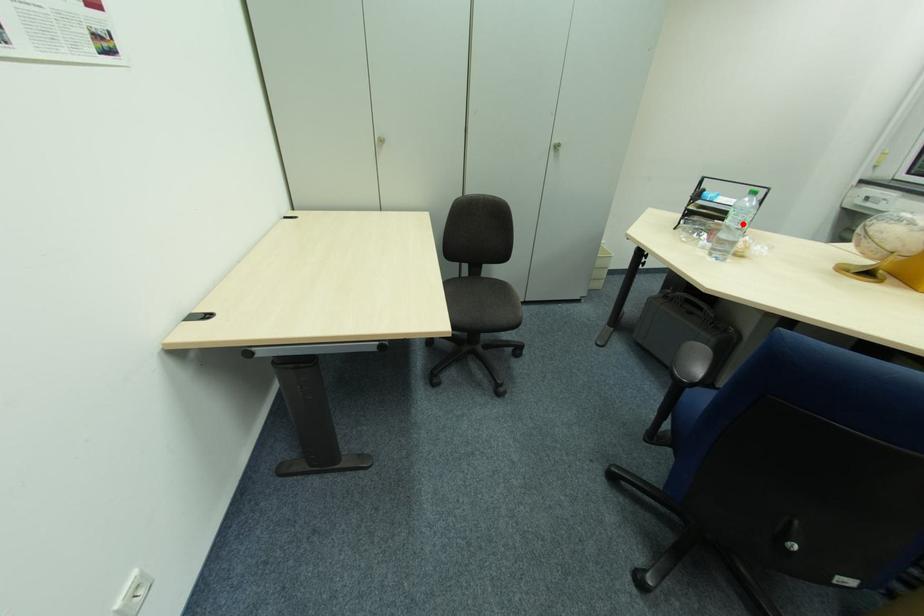
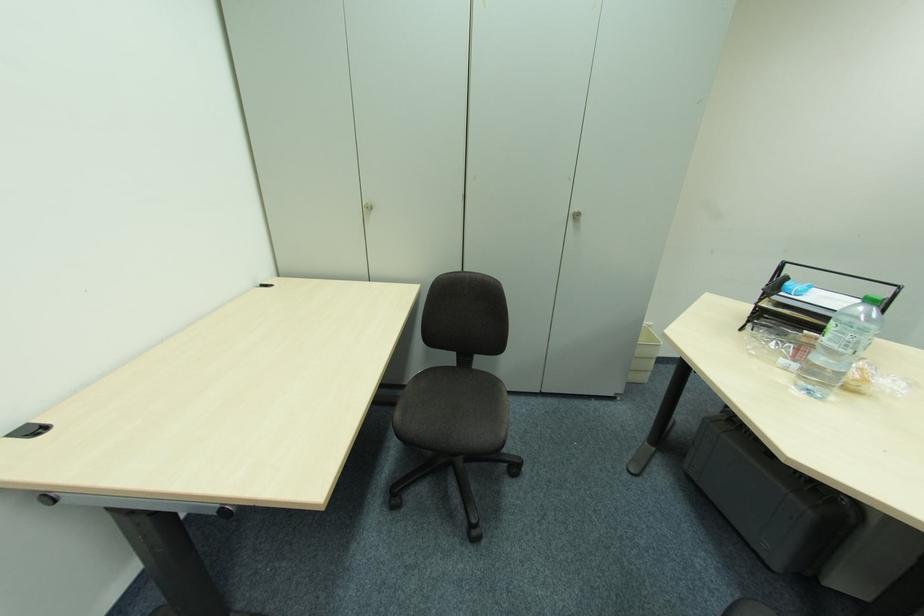
Question: I am providing you with two images of the same scene from different viewpoints. A red point is marked on the first image. At the location where the point appears in image 1, is it still visible in image 2?

Choices:
 (A) Yes
 (B) No

Answer: (A)